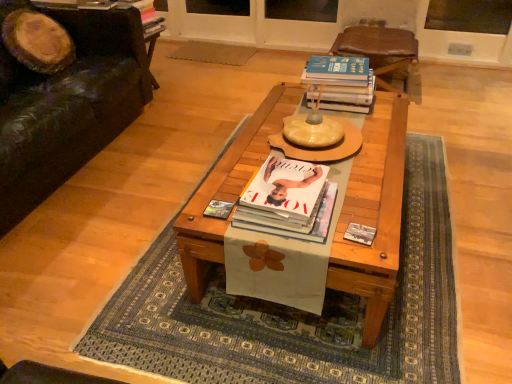
Locate an element on the screen. The image size is (512, 384). vacant region to the right of gray matte paperback book at center is located at coordinates pos(386,234).